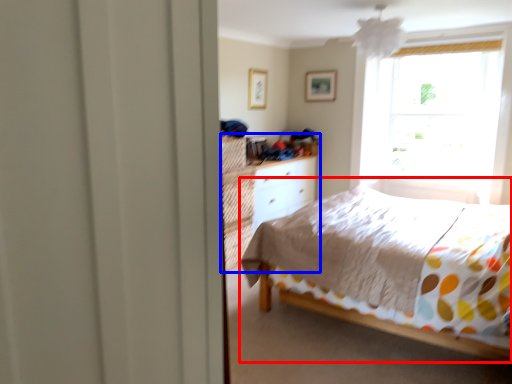
Question: Which object appears farthest to the camera in this image, bed (highlighted by a red box) or dresser (highlighted by a blue box)?

Choices:
 (A) bed
 (B) dresser

Answer: (B)